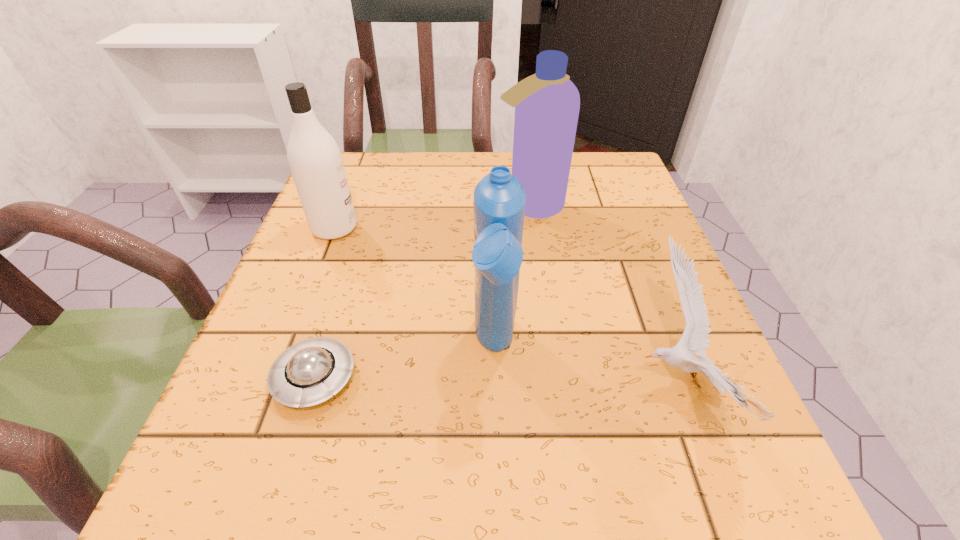
Locate an element on the screen. This screenshot has width=960, height=540. the nearest shampoo is located at coordinates (499, 199).

Identify the location of the leftmost shampoo. The width and height of the screenshot is (960, 540). (315, 160).

At what (x,y) coordinates should I click in order to perform the action: click on the rightmost object. Please return your answer as a coordinate pair (x, y). Looking at the image, I should click on tap(694, 340).

Locate an element on the screen. This screenshot has width=960, height=540. the second shortest object is located at coordinates (694, 340).

Find the location of a particular element. The width and height of the screenshot is (960, 540). the shortest object is located at coordinates (310, 372).

Locate an element on the screen. free region located on the back of the nearest shampoo is located at coordinates (491, 208).

You are a GUI agent. You are given a task and a screenshot of the screen. Output one action in this format:
    pyautogui.click(x=<x>, y=<y>)
    Task: Click on the free region located on the front-facing side of the leftmost shampoo
    Image resolution: width=960 pixels, height=540 pixels.
    Given the screenshot: What is the action you would take?
    pyautogui.click(x=386, y=228)

Identify the location of free location located 0.400m at the tip of the beak of the fourth tallest object. This screenshot has height=540, width=960. (368, 382).

Find the location of `vacant space situated 0.340m at the tip of the beak of the fourth tallest object`. vacant space situated 0.340m at the tip of the beak of the fourth tallest object is located at coordinates tap(408, 382).

You are a GUI agent. You are given a task and a screenshot of the screen. Output one action in this format:
    pyautogui.click(x=<x>, y=<y>)
    Task: Click on the free space located 0.100m at the tip of the beak of the fourth tallest object
    The width and height of the screenshot is (960, 540).
    Given the screenshot: What is the action you would take?
    pyautogui.click(x=568, y=382)